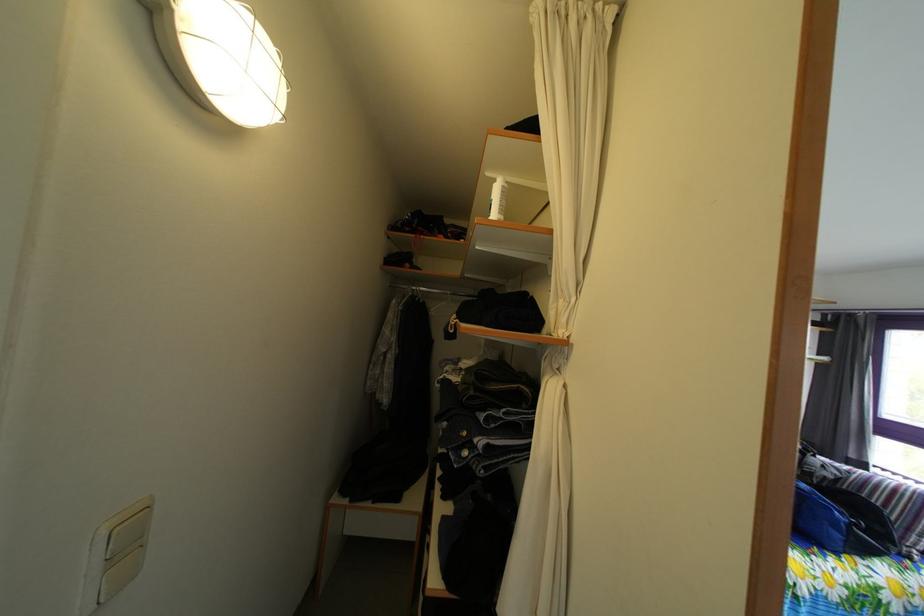
Identify the location of white spray bottle. This screenshot has height=616, width=924. (497, 199).